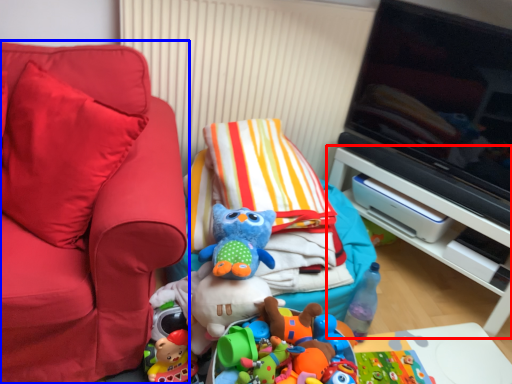
Question: Which point is further to the camera, furniture (highlighted by a red box) or furniture (highlighted by a blue box)?

Choices:
 (A) furniture
 (B) furniture

Answer: (A)